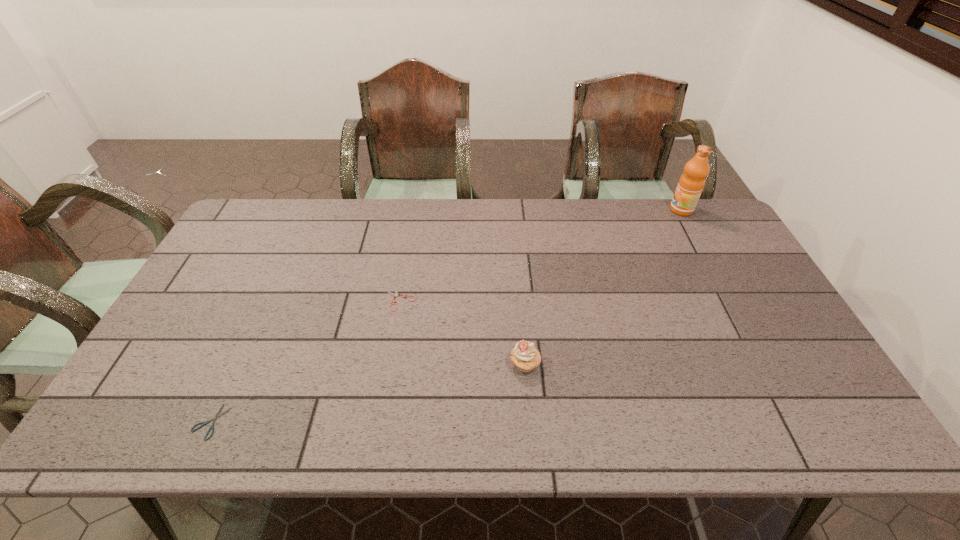
Locate an element on the screen. The height and width of the screenshot is (540, 960). vacant area that lies between the third shortest object and the nearest object is located at coordinates (368, 393).

Image resolution: width=960 pixels, height=540 pixels. I want to click on vacant area that lies between the farthest object and the farther shears, so click(x=540, y=254).

The width and height of the screenshot is (960, 540). I want to click on free space between the farther shears and the tallest object, so click(540, 254).

I want to click on free point between the third nearest object and the farthest object, so pyautogui.click(x=540, y=254).

The image size is (960, 540). Identify the location of unoccupied position between the third farthest object and the fruit juice. (x=603, y=287).

Point out which object is positioned as the second nearest to the second farthest object. Please provide its 2D coordinates. Your answer should be formatted as a tuple, i.e. [(x, y)], where the tuple contains the x and y coordinates of a point satisfying the conditions above.

[(217, 415)]

Choose which object is the third nearest neighbor to the second tallest object. Please provide its 2D coordinates. Your answer should be formatted as a tuple, i.e. [(x, y)], where the tuple contains the x and y coordinates of a point satisfying the conditions above.

[(691, 183)]

At what (x,y) coordinates should I click in order to perform the action: click on blank space that satisfies the following two spatial constraints: 1. on the back side of the second object from right to left; 2. on the left side of the nearer shears. Please return your answer as a coordinate pair (x, y). The height and width of the screenshot is (540, 960). Looking at the image, I should click on (237, 364).

The height and width of the screenshot is (540, 960). I want to click on vacant region that satisfies the following two spatial constraints: 1. on the back side of the nearest object; 2. on the right side of the third shortest object, so click(x=237, y=364).